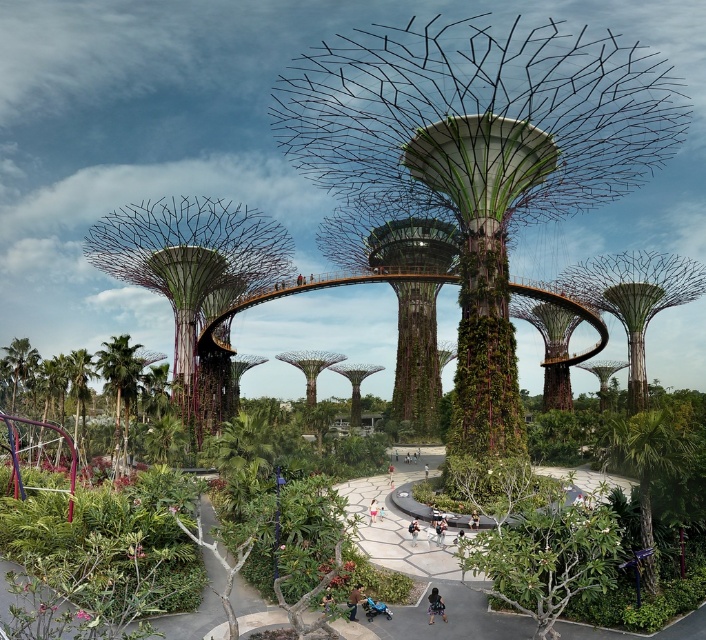
Question: Which object is the closest to the brown leather jacket at lower center?

Choices:
 (A) blue plastic toy at lower center
 (B) green matte roller coaster at lower left

Answer: (A)

Question: Can you confirm if green leafy palm tree at lower left is positioned to the left of light blue denim shorts at lower center?

Choices:
 (A) yes
 (B) no

Answer: (A)

Question: Does green matte roller coaster at lower left have a greater width compared to light blue denim shorts at lower center?

Choices:
 (A) yes
 (B) no

Answer: (A)

Question: Which point appears farthest from the camera in this image?

Choices:
 (A) (121, 396)
 (B) (369, 611)
 (C) (369, 524)
 (D) (436, 596)

Answer: (A)

Question: Which of the following is the farthest from the observer?

Choices:
 (A) (370, 600)
 (B) (431, 614)
 (C) (347, 598)

Answer: (A)

Question: Does green matte roller coaster at lower left appear over green leafy palm tree at lower left?

Choices:
 (A) no
 (B) yes

Answer: (B)